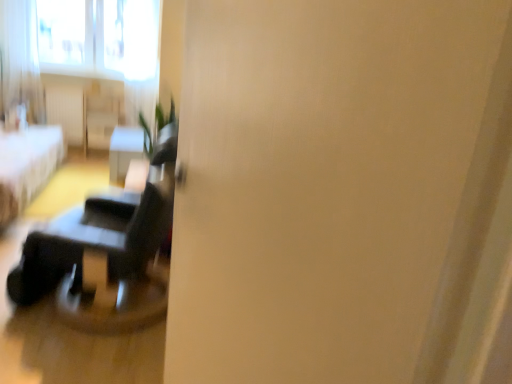
Question: Does white fabric bed at left have a lesser width compared to white sheer curtain at upper left?

Choices:
 (A) yes
 (B) no

Answer: (B)

Question: From a real-world perspective, is white fabric bed at left on top of white sheer curtain at upper left?

Choices:
 (A) yes
 (B) no

Answer: (B)

Question: Considering the relative positions of white fabric bed at left and white sheer curtain at upper left in the image provided, is white fabric bed at left to the left of white sheer curtain at upper left from the viewer's perspective?

Choices:
 (A) no
 (B) yes

Answer: (A)

Question: From the image's perspective, would you say white fabric bed at left is shown under white sheer curtain at upper left?

Choices:
 (A) no
 (B) yes

Answer: (B)

Question: Is white fabric bed at left bigger than white sheer curtain at upper left?

Choices:
 (A) yes
 (B) no

Answer: (A)

Question: Is white sheer curtain at upper left spatially inside matte black table at center, or outside of it?

Choices:
 (A) inside
 (B) outside

Answer: (B)

Question: Considering the positions of white sheer curtain at upper left and matte black table at center in the image, is white sheer curtain at upper left wider or thinner than matte black table at center?

Choices:
 (A) wide
 (B) thin

Answer: (B)

Question: Looking at the image, does white sheer curtain at upper left seem bigger or smaller compared to matte black table at center?

Choices:
 (A) small
 (B) big

Answer: (A)

Question: From the image's perspective, is white sheer curtain at upper left located above or below matte black table at center?

Choices:
 (A) above
 (B) below

Answer: (A)

Question: Considering their positions, is matte black table at center located in front of or behind white sheer curtain at upper left?

Choices:
 (A) behind
 (B) front

Answer: (B)

Question: Considering the positions of matte black table at center and white sheer curtain at upper left in the image, is matte black table at center taller or shorter than white sheer curtain at upper left?

Choices:
 (A) short
 (B) tall

Answer: (A)

Question: From a real-world perspective, is matte black table at center positioned above or below white sheer curtain at upper left?

Choices:
 (A) above
 (B) below

Answer: (B)

Question: In terms of size, does matte black table at center appear bigger or smaller than white sheer curtain at upper left?

Choices:
 (A) small
 (B) big

Answer: (B)

Question: From a real-world perspective, is matte black table at center physically located above or below white fabric bed at left?

Choices:
 (A) below
 (B) above

Answer: (A)

Question: Is matte black table at center bigger or smaller than white fabric bed at left?

Choices:
 (A) big
 (B) small

Answer: (B)